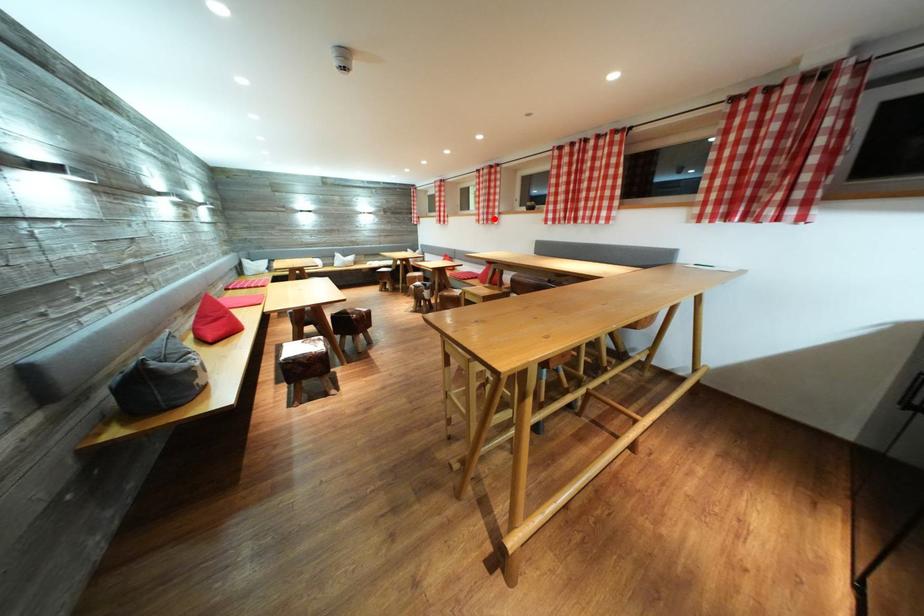
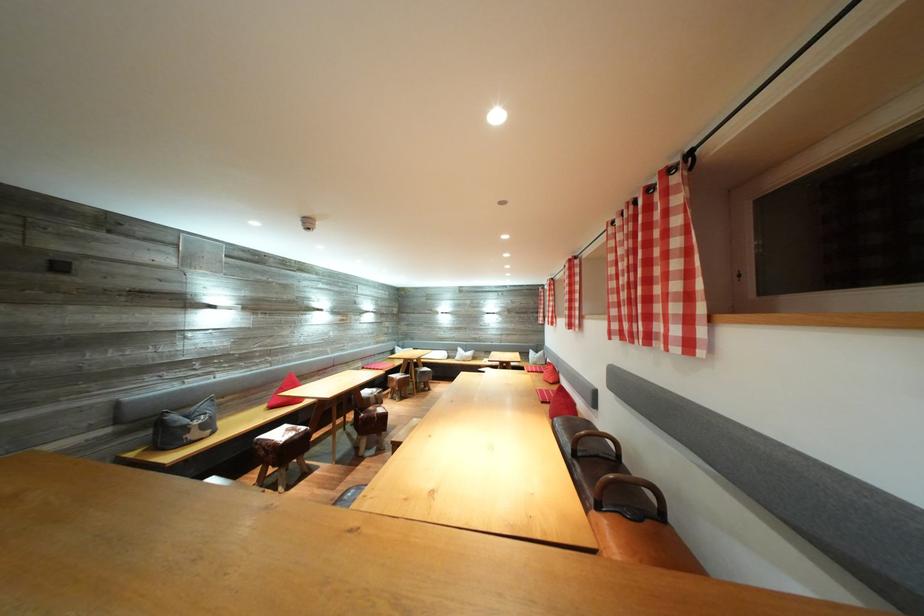
Question: A red point is marked in image1. In image2, is the corresponding 3D point closer to the camera or farther? Reply with the corresponding letter.

Choices:
 (A) The corresponding 3D point is closer.
 (B) The corresponding 3D point is farther.

Answer: (B)